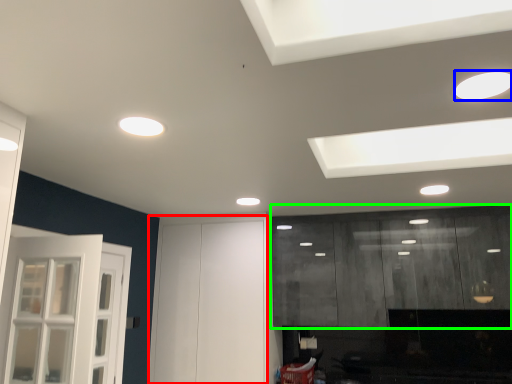
Question: Based on their relative distances, which object is nearer to door (highlighted by a red box)? Choose from lighting (highlighted by a blue box) and cabinetry (highlighted by a green box).

Choices:
 (A) lighting
 (B) cabinetry

Answer: (B)